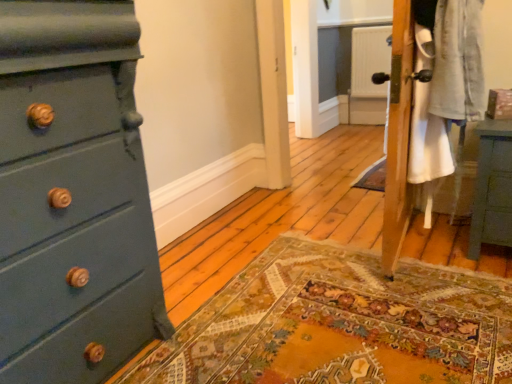
Question: In terms of height, does matte teal dresser at left look taller or shorter compared to teal painted wood nightstand at right?

Choices:
 (A) short
 (B) tall

Answer: (B)

Question: Would you say matte teal dresser at left is to the left or to the right of teal painted wood nightstand at right in the picture?

Choices:
 (A) left
 (B) right

Answer: (A)

Question: Considering the positions of matte teal dresser at left and teal painted wood nightstand at right in the image, is matte teal dresser at left wider or thinner than teal painted wood nightstand at right?

Choices:
 (A) wide
 (B) thin

Answer: (A)

Question: In terms of width, does teal painted wood nightstand at right look wider or thinner when compared to matte teal dresser at left?

Choices:
 (A) thin
 (B) wide

Answer: (A)

Question: From the image's perspective, relative to matte teal dresser at left, is teal painted wood nightstand at right above or below?

Choices:
 (A) below
 (B) above

Answer: (B)

Question: Is point (505, 200) positioned closer to the camera than point (46, 89)?

Choices:
 (A) closer
 (B) farther

Answer: (B)

Question: In terms of height, does teal painted wood nightstand at right look taller or shorter compared to matte teal dresser at left?

Choices:
 (A) short
 (B) tall

Answer: (A)